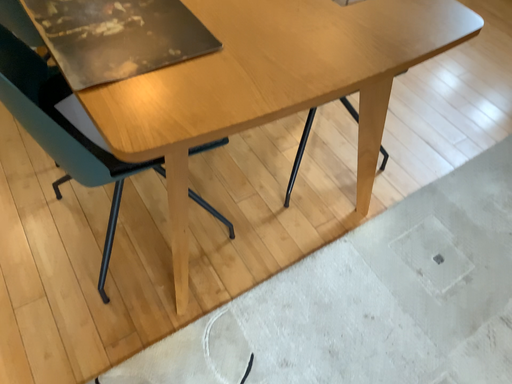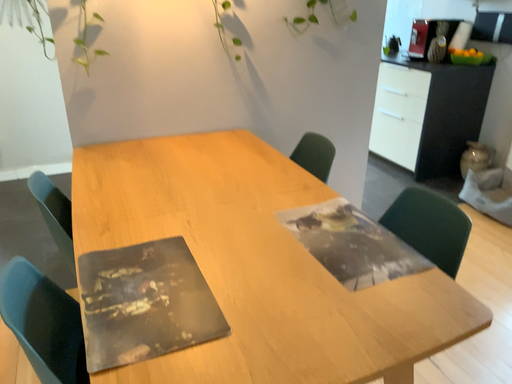
Question: How did the camera likely rotate when shooting the video?

Choices:
 (A) rotated downward
 (B) rotated upward

Answer: (B)